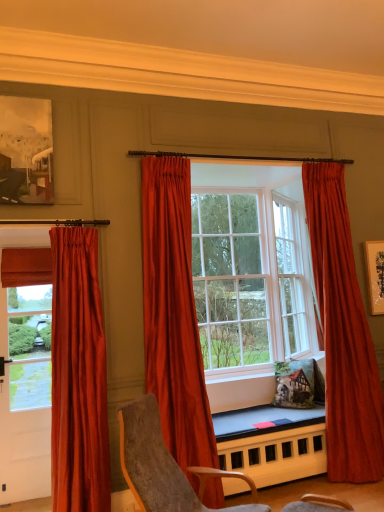
Identify the location of vacant space situated above matte wooden picture frame at upper left (from a real-world perspective). 21,95.